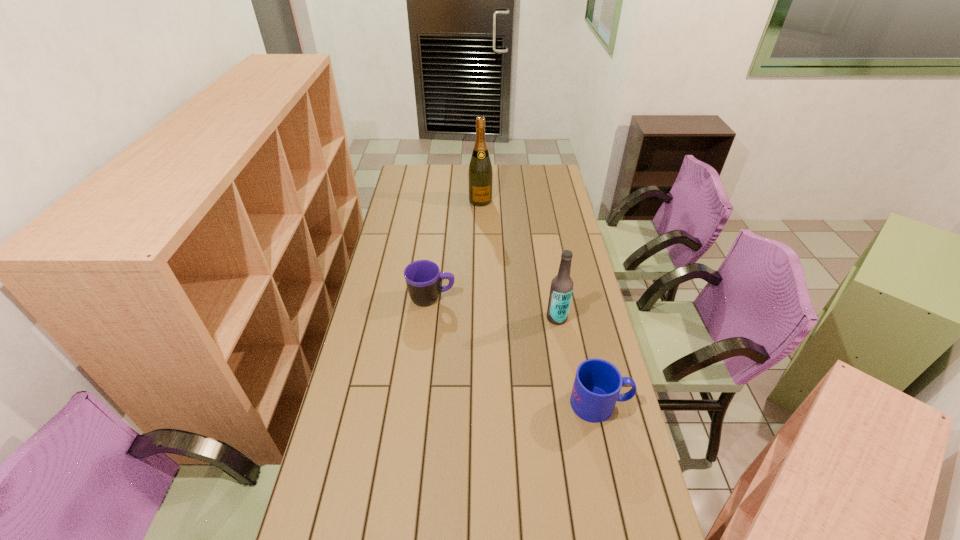
Image resolution: width=960 pixels, height=540 pixels. Identify the location of the farther mug. (423, 278).

The width and height of the screenshot is (960, 540). Identify the location of the leftmost object. (423, 278).

This screenshot has width=960, height=540. In order to click on the nearest object in this screenshot , I will do `click(597, 384)`.

You are a GUI agent. You are given a task and a screenshot of the screen. Output one action in this format:
    pyautogui.click(x=<x>, y=<y>)
    Task: Click on the nearer mug
    Image resolution: width=960 pixels, height=540 pixels.
    Given the screenshot: What is the action you would take?
    pyautogui.click(x=597, y=384)

At what (x,y) coordinates should I click in order to perform the action: click on the second tallest object. Please return your answer as a coordinate pair (x, y). The height and width of the screenshot is (540, 960). Looking at the image, I should click on (561, 289).

Where is `wine bottle`? The height and width of the screenshot is (540, 960). wine bottle is located at coordinates (480, 174).

Image resolution: width=960 pixels, height=540 pixels. I want to click on the tallest object, so click(x=480, y=174).

The width and height of the screenshot is (960, 540). In order to click on free location located with the handle on the side of the farther mug in this screenshot , I will do `click(516, 298)`.

Locate an element on the screen. vacant space positioned 0.320m on the label of the second tallest object is located at coordinates (479, 363).

Find the location of a particular element. The image size is (960, 540). free space located on the label of the second tallest object is located at coordinates (486, 359).